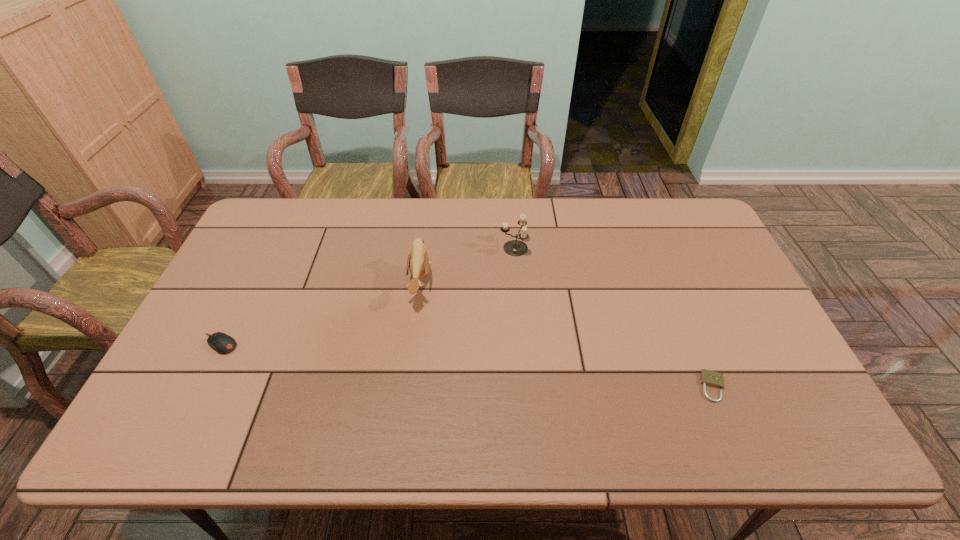
Where is `object present at the far edge`? object present at the far edge is located at coordinates (516, 248).

Locate an element on the screen. This screenshot has height=540, width=960. object that is at the left edge is located at coordinates click(x=222, y=343).

Locate an element on the screen. This screenshot has height=540, width=960. free space at the far edge is located at coordinates (557, 233).

The height and width of the screenshot is (540, 960). In order to click on vacant area at the near edge of the desktop in this screenshot , I will do `click(480, 444)`.

In order to click on free space at the left edge of the desktop in this screenshot , I will do `click(226, 304)`.

Identify the location of vacant space at the right edge of the desktop. The height and width of the screenshot is (540, 960). click(x=762, y=334).

Locate an element on the screen. This screenshot has width=960, height=540. vacant region at the near left corner of the desktop is located at coordinates (188, 428).

This screenshot has width=960, height=540. What are the coordinates of `unoccupied area between the second object from right to left and the bird` in the screenshot? It's located at (467, 266).

This screenshot has height=540, width=960. What are the coordinates of `vacant area that lies between the computer mouse and the third object from right to left` in the screenshot? It's located at (320, 314).

The width and height of the screenshot is (960, 540). In order to click on vacant area that lies between the third object from left to right and the shortest object in this screenshot , I will do `click(613, 317)`.